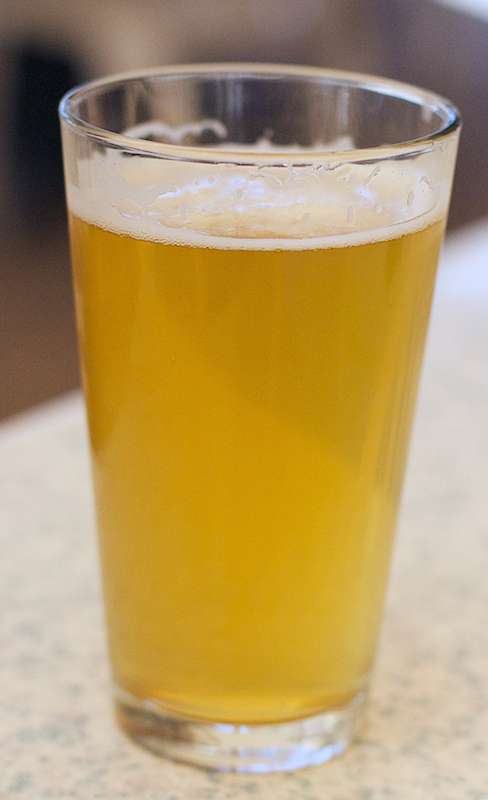
You are a GUI agent. You are given a task and a screenshot of the screen. Output one action in this format:
    pyautogui.click(x=<x>, y=<y>)
    Task: Click on the black marbling on tabletop
    
    Given the screenshot: What is the action you would take?
    coord(422,736), coord(405,750), coord(95,773), coord(130,765), coord(367,792), coord(475,790), coord(384,712), coord(418,704)